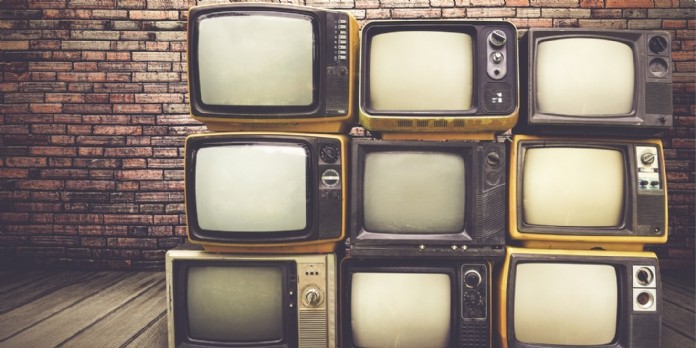
Identify the location of old crt tvs. (271, 46), (477, 98), (568, 97), (553, 181), (425, 195), (269, 281), (379, 302), (598, 310).